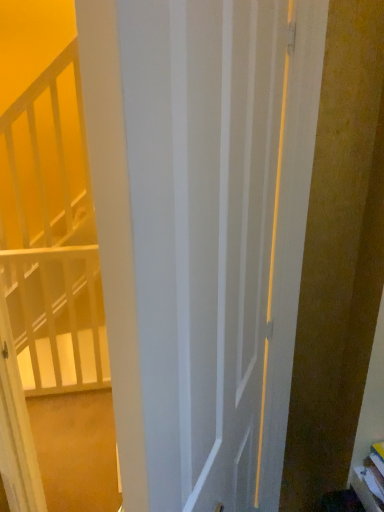
Image resolution: width=384 pixels, height=512 pixels. What are the coordinates of `white glossy door at center` in the screenshot? It's located at (204, 239).

The height and width of the screenshot is (512, 384). Describe the element at coordinates (204, 239) in the screenshot. I see `white glossy door at center` at that location.

At what (x,y) coordinates should I click in order to perform the action: click on white glossy door at center. Please return your answer as a coordinate pair (x, y). This screenshot has height=512, width=384. Looking at the image, I should click on (204, 239).